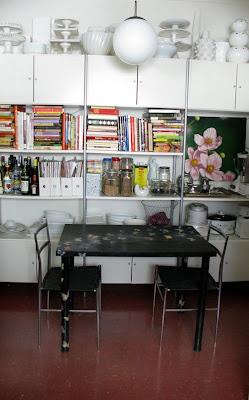
Identify the location of black table. This screenshot has width=249, height=400. (143, 246).